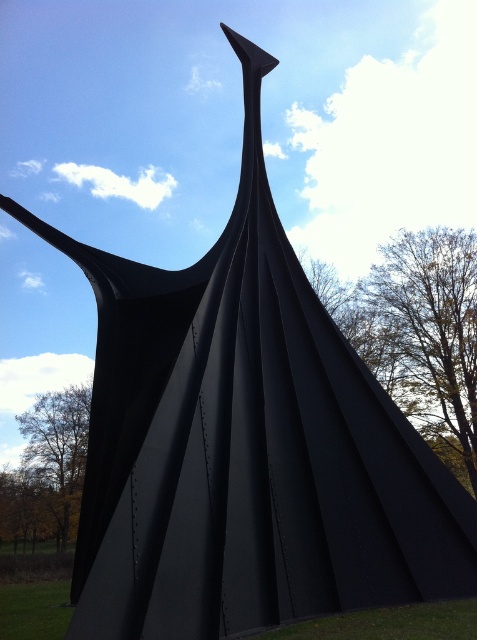
You are standing in front of the sculpture and want to find a spot to place your bag. You see the green leafy tree at upper right and the green grass at lower center. Which location is to the right of the other?

The green leafy tree at upper right is positioned on the right side of green grass at lower center.

You are a gardener planning to plant flowers between the brown leafy tree at lower left and the green grass at lower center. Can you determine if there is enough space between them for planting?

The brown leafy tree at lower left is positioned under green grass at lower center, meaning they are vertically aligned. This suggests there is limited horizontal space between them, making it difficult to plant flowers in between.